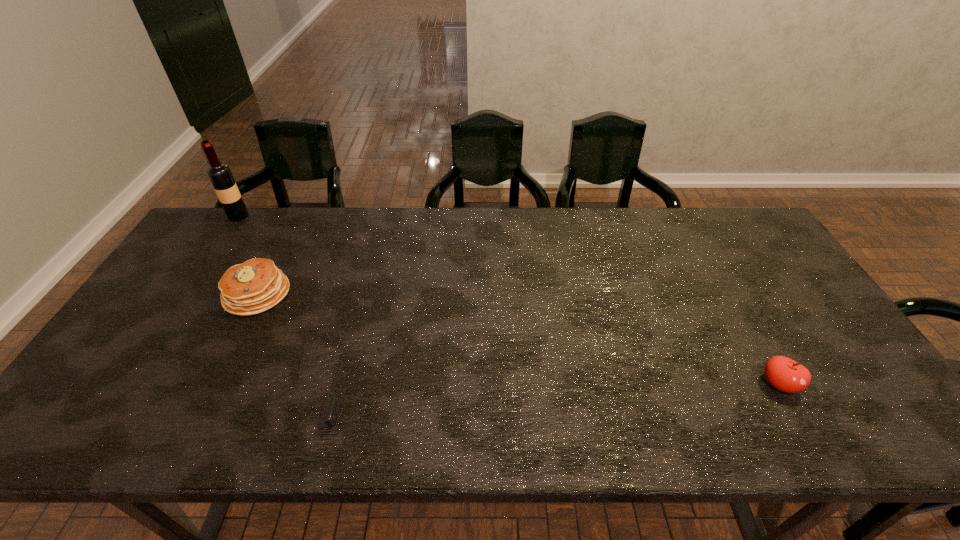
Locate an element on the screen. Image resolution: width=960 pixels, height=540 pixels. vacant space located on the right of the rightmost object is located at coordinates (859, 384).

Find the location of a particular element. vacant space located on the front-facing side of the second object from right to left is located at coordinates (477, 422).

Where is `object situated at the far edge`? Image resolution: width=960 pixels, height=540 pixels. object situated at the far edge is located at coordinates (219, 174).

Find the location of a particular element. The height and width of the screenshot is (540, 960). object that is at the near edge is located at coordinates (329, 413).

The width and height of the screenshot is (960, 540). What are the coordinates of `object that is at the left edge` in the screenshot? It's located at (219, 174).

This screenshot has height=540, width=960. Identify the location of object located in the far left corner section of the desktop. (219, 174).

The width and height of the screenshot is (960, 540). What are the coordinates of `free space at the far edge of the desktop` in the screenshot? It's located at click(527, 210).

Image resolution: width=960 pixels, height=540 pixels. I want to click on free space at the near edge of the desktop, so click(564, 441).

Identify the location of vacant space at the left edge of the desktop. (192, 282).

Identify the location of free point between the second nearest object and the leftmost object. Image resolution: width=960 pixels, height=540 pixels. (509, 300).